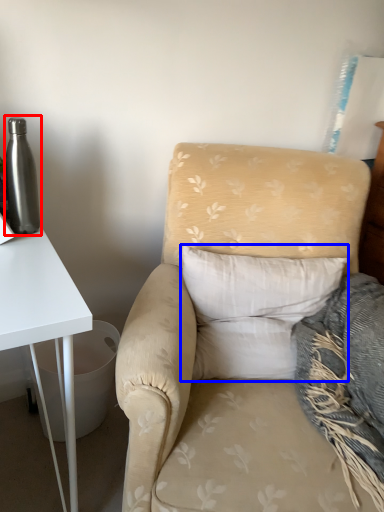
Question: Which of the following is the farthest to the observer, bottle (highlighted by a red box) or pillow (highlighted by a blue box)?

Choices:
 (A) bottle
 (B) pillow

Answer: (B)